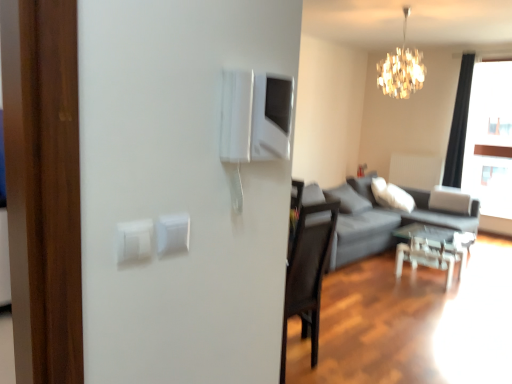
The height and width of the screenshot is (384, 512). Describe the element at coordinates (416, 171) in the screenshot. I see `white plastic radiator at upper right` at that location.

Image resolution: width=512 pixels, height=384 pixels. What do you see at coordinates (172, 233) in the screenshot?
I see `white plastic light switch at center, acting as the first light switch starting from the right` at bounding box center [172, 233].

Find the location of a particular element. white plastic light switch at center, positioned as the 2th light switch in left-to-right order is located at coordinates (172, 233).

What do you see at coordinates (401, 69) in the screenshot? I see `shiny crystal chandelier at upper center` at bounding box center [401, 69].

You are a GUI agent. You are given a task and a screenshot of the screen. Output one action in this format:
    pyautogui.click(x=<x>, y=<y>)
    Task: Click on the transparent glass table at lower right
    This screenshot has height=384, width=512.
    Given the screenshot: What is the action you would take?
    pyautogui.click(x=433, y=248)

Does white plastic light switch at center, which appears as the first light switch when viewed from the back, lie behind shiny crystal chandelier at upper center?

No, it is in front of shiny crystal chandelier at upper center.

Which is in front, point (182, 247) or point (389, 65)?

Point (182, 247)

Based on their sizes in the image, would you say white plastic light switch at center, positioned as the 2th light switch in left-to-right order, is bigger or smaller than shiny crystal chandelier at upper center?

Clearly, white plastic light switch at center, positioned as the 2th light switch in left-to-right order, is smaller in size than shiny crystal chandelier at upper center.

Measure the distance between dark gray fabric couch at right and white plastic light switch at center, positioned as the 2th light switch in left-to-right order.

4.43 meters.

Which object is more forward, dark gray fabric couch at right or white plastic light switch at center, acting as the first light switch starting from the right?

white plastic light switch at center, acting as the first light switch starting from the right, is more forward.

From a real-world perspective, is dark gray fabric couch at right physically above white plastic light switch at center, acting as the first light switch starting from the right?

Actually, dark gray fabric couch at right is physically below white plastic light switch at center, acting as the first light switch starting from the right, in the real world.

Considering the relative positions of dark gray fabric couch at right and white plastic light switch at center, which appears as the first light switch when viewed from the back, in the image provided, is dark gray fabric couch at right to the right of white plastic light switch at center, which appears as the first light switch when viewed from the back, from the viewer's perspective?

Yes, dark gray fabric couch at right is to the right of white plastic light switch at center, which appears as the first light switch when viewed from the back.

Based on their sizes in the image, would you say black fabric curtain at upper right is bigger or smaller than transparent glass table at lower right?

Considering their sizes, black fabric curtain at upper right takes up more space than transparent glass table at lower right.

Which of these two, black fabric curtain at upper right or transparent glass table at lower right, is wider?

transparent glass table at lower right.

Is black fabric curtain at upper right directly adjacent to transparent glass table at lower right?

They are not placed beside each other.

Locate an element on the screen. The width and height of the screenshot is (512, 384). table on the left of black fabric curtain at upper right is located at coordinates (433, 248).

Considering the relative sizes of white plastic light switch at center, marked as the 2th light switch in a front-to-back arrangement, and white plastic light switch at upper left, which ranks as the first light switch in left-to-right order, in the image provided, is white plastic light switch at center, marked as the 2th light switch in a front-to-back arrangement, shorter than white plastic light switch at upper left, which ranks as the first light switch in left-to-right order,?

Yes, white plastic light switch at center, marked as the 2th light switch in a front-to-back arrangement, is shorter than white plastic light switch at upper left, which ranks as the first light switch in left-to-right order.

How much distance is there between white plastic light switch at center, acting as the first light switch starting from the right, and white plastic light switch at upper left, acting as the second light switch starting from the back?

They are 5.40 centimeters apart.

Which of these two, white plastic light switch at center, acting as the first light switch starting from the right, or white plastic light switch at upper left, which ranks as the first light switch in left-to-right order, is wider?

With larger width is white plastic light switch at upper left, which ranks as the first light switch in left-to-right order.

Is white plastic light switch at center, which appears as the first light switch when viewed from the back, not within white plastic light switch at upper left, which ranks as the first light switch in left-to-right order?

Yes.

How much distance is there between shiny crystal chandelier at upper center and white plastic light switch at center, acting as the first light switch starting from the right?

shiny crystal chandelier at upper center and white plastic light switch at center, acting as the first light switch starting from the right, are 12.89 feet apart.

Is shiny crystal chandelier at upper center not close to white plastic light switch at center, marked as the 2th light switch in a front-to-back arrangement?

Indeed, shiny crystal chandelier at upper center is not near white plastic light switch at center, marked as the 2th light switch in a front-to-back arrangement.

Which of these two, shiny crystal chandelier at upper center or white plastic light switch at center, which appears as the first light switch when viewed from the back, is wider?

shiny crystal chandelier at upper center.

Considering the positions of objects transparent glass table at lower right and white plastic light switch at center, which appears as the first light switch when viewed from the back, in the image provided, who is more to the right, transparent glass table at lower right or white plastic light switch at center, which appears as the first light switch when viewed from the back,?

Positioned to the right is transparent glass table at lower right.

Is transparent glass table at lower right wider than white plastic light switch at center, which appears as the first light switch when viewed from the back?

Correct, the width of transparent glass table at lower right exceeds that of white plastic light switch at center, which appears as the first light switch when viewed from the back.

This screenshot has height=384, width=512. Identify the location of the 1st light switch located above the transparent glass table at lower right (from a real-world perspective). (172, 233).

From a real-world perspective, between transparent glass table at lower right and white plastic light switch at center, which appears as the first light switch when viewed from the back, who is vertically higher?

white plastic light switch at center, which appears as the first light switch when viewed from the back, from a real-world perspective.

Is dark gray fabric couch at right oriented away from shiny crystal chandelier at upper center?

That's not correct — dark gray fabric couch at right is not looking away from shiny crystal chandelier at upper center.

Is point (344, 251) closer to camera compared to point (386, 82)?

Yes, it is in front of point (386, 82).

Can shiny crystal chandelier at upper center be found inside dark gray fabric couch at right?

No, shiny crystal chandelier at upper center is not inside dark gray fabric couch at right.

Based on the photo, considering the relative sizes of dark gray fabric couch at right and shiny crystal chandelier at upper center in the image provided, is dark gray fabric couch at right taller than shiny crystal chandelier at upper center?

Yes.

The height and width of the screenshot is (384, 512). What are the coordinates of `light switch that is the 1st one when counting forward from the shiny crystal chandelier at upper center` in the screenshot? It's located at (172, 233).

You are a GUI agent. You are given a task and a screenshot of the screen. Output one action in this format:
    pyautogui.click(x=<x>, y=<y>)
    Task: Click on the studio couch on the right of white plastic light switch at center, positioned as the 2th light switch in left-to-right order
    The width and height of the screenshot is (512, 384).
    Given the screenshot: What is the action you would take?
    pyautogui.click(x=378, y=219)

Looking at the image, which one is located closer to white plastic light switch at center, which appears as the first light switch when viewed from the back, white plastic radiator at upper right or white plastic light switch at upper left, which ranks as the first light switch in left-to-right order?

white plastic light switch at upper left, which ranks as the first light switch in left-to-right order.

From the image, which object appears to be farther from dark gray fabric couch at right, white plastic radiator at upper right or white plastic light switch at upper left, which ranks as the second light switch in right-to-left order?

Based on the image, white plastic light switch at upper left, which ranks as the second light switch in right-to-left order, appears to be further to dark gray fabric couch at right.

Which object lies further to the anchor point white plastic light switch at upper left, acting as the second light switch starting from the back, black fabric curtain at upper right or dark gray fabric couch at right?

Among the two, black fabric curtain at upper right is located further to white plastic light switch at upper left, acting as the second light switch starting from the back.

Which object lies further to the anchor point dark gray fabric couch at right, black fabric curtain at upper right or transparent glass table at lower right?

black fabric curtain at upper right is positioned further to the anchor dark gray fabric couch at right.

Looking at the image, which one is located further to white plastic light switch at upper left, which ranks as the second light switch in right-to-left order, dark gray fabric couch at right or shiny crystal chandelier at upper center?

dark gray fabric couch at right is positioned further to the anchor white plastic light switch at upper left, which ranks as the second light switch in right-to-left order.

Considering their positions, is white plastic light switch at center, positioned as the 2th light switch in left-to-right order, positioned further to white plastic radiator at upper right than dark gray fabric couch at right?

white plastic light switch at center, positioned as the 2th light switch in left-to-right order, is positioned further to the anchor white plastic radiator at upper right.

Based on their spatial positions, is shiny crystal chandelier at upper center or white plastic radiator at upper right closer to white plastic light switch at upper left, which ranks as the second light switch in right-to-left order?

shiny crystal chandelier at upper center lies closer to white plastic light switch at upper left, which ranks as the second light switch in right-to-left order, than the other object.

Considering their positions, is white plastic radiator at upper right positioned further to white plastic light switch at upper left, acting as the second light switch starting from the back, than shiny crystal chandelier at upper center?

white plastic radiator at upper right is positioned further to the anchor white plastic light switch at upper left, acting as the second light switch starting from the back.

Locate an element on the screen. This screenshot has width=512, height=384. curtain located between transparent glass table at lower right and white plastic radiator at upper right in the depth direction is located at coordinates (459, 124).

Where is `table between white plastic light switch at center, marked as the 2th light switch in a front-to-back arrangement, and white plastic radiator at upper right, along the z-axis`? The height and width of the screenshot is (384, 512). table between white plastic light switch at center, marked as the 2th light switch in a front-to-back arrangement, and white plastic radiator at upper right, along the z-axis is located at coordinates (433, 248).

Identify the location of studio couch located between white plastic light switch at upper left, acting as the second light switch starting from the back, and black fabric curtain at upper right in the depth direction. This screenshot has height=384, width=512. (378, 219).

What are the coordinates of `light switch between white plastic light switch at upper left, marked as the 1th light switch in a front-to-back arrangement, and shiny crystal chandelier at upper center from front to back` in the screenshot? It's located at (172, 233).